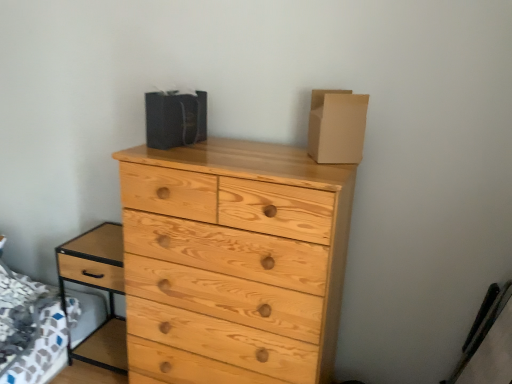
Question: Considering the relative sizes of matte black bag at upper center, positioned as the 1th cardboard box in left-to-right order, and light brown wood nightstand at lower left in the image provided, is matte black bag at upper center, positioned as the 1th cardboard box in left-to-right order, bigger than light brown wood nightstand at lower left?

Choices:
 (A) yes
 (B) no

Answer: (B)

Question: Would you say light brown wood nightstand at lower left is part of matte black bag at upper center, the second cardboard box positioned from the right,'s contents?

Choices:
 (A) yes
 (B) no

Answer: (B)

Question: From the image's perspective, does matte black bag at upper center, the second cardboard box positioned from the right, appear higher than light brown wood nightstand at lower left?

Choices:
 (A) yes
 (B) no

Answer: (A)

Question: Can you confirm if matte black bag at upper center, positioned as the 1th cardboard box in left-to-right order, is positioned to the left of light brown wood nightstand at lower left?

Choices:
 (A) no
 (B) yes

Answer: (A)

Question: Is matte black bag at upper center, positioned as the 1th cardboard box in left-to-right order, shorter than light brown wood nightstand at lower left?

Choices:
 (A) yes
 (B) no

Answer: (A)

Question: Considering the positions of light brown wood nightstand at lower left and natural wood chest of drawers at center in the image, is light brown wood nightstand at lower left wider or thinner than natural wood chest of drawers at center?

Choices:
 (A) wide
 (B) thin

Answer: (B)

Question: Considering their positions, is light brown wood nightstand at lower left located in front of or behind natural wood chest of drawers at center?

Choices:
 (A) front
 (B) behind

Answer: (B)

Question: Choose the correct answer: Is light brown wood nightstand at lower left inside natural wood chest of drawers at center or outside it?

Choices:
 (A) inside
 (B) outside

Answer: (B)

Question: In terms of size, does light brown wood nightstand at lower left appear bigger or smaller than natural wood chest of drawers at center?

Choices:
 (A) small
 (B) big

Answer: (A)

Question: Does point (176, 379) appear closer or farther from the camera than point (197, 107)?

Choices:
 (A) farther
 (B) closer

Answer: (A)

Question: From a real-world perspective, is natural wood chest of drawers at center physically located above or below matte black bag at upper center, the second cardboard box positioned from the right?

Choices:
 (A) above
 (B) below

Answer: (B)

Question: Would you say natural wood chest of drawers at center is inside or outside matte black bag at upper center, the second cardboard box positioned from the right?

Choices:
 (A) outside
 (B) inside

Answer: (A)

Question: From the image's perspective, is natural wood chest of drawers at center above or below matte black bag at upper center, positioned as the 1th cardboard box in left-to-right order?

Choices:
 (A) above
 (B) below

Answer: (B)

Question: From a real-world perspective, is light brown wood nightstand at lower left above or below brown cardboard box at upper right, which appears as the 1th cardboard box when viewed from the right?

Choices:
 (A) above
 (B) below

Answer: (B)

Question: Is light brown wood nightstand at lower left to the left or to the right of brown cardboard box at upper right, the second cardboard box viewed from the left, in the image?

Choices:
 (A) left
 (B) right

Answer: (A)